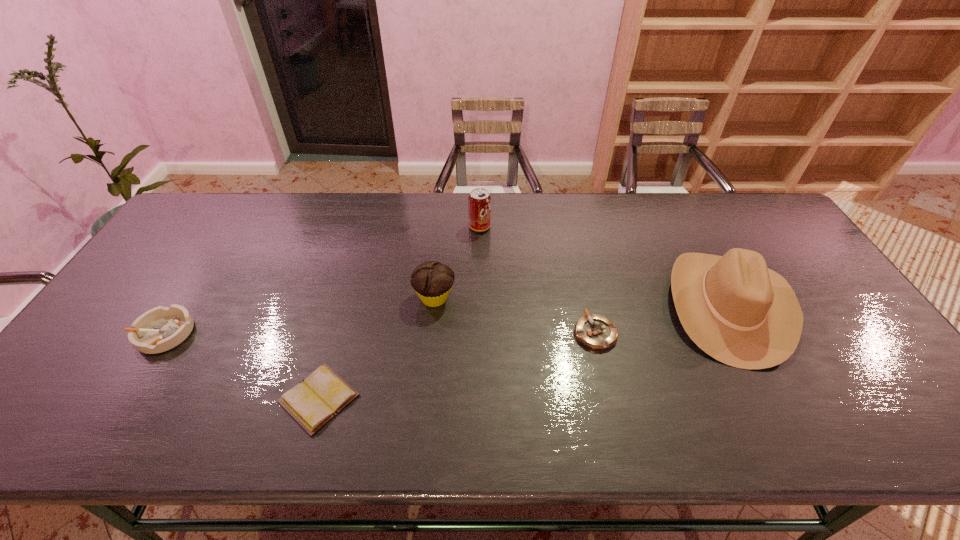
In order to click on object that is at the left edge in this screenshot , I will do 160,329.

Locate an element on the screen. The image size is (960, 540). object located at the right edge is located at coordinates [743, 314].

The image size is (960, 540). I want to click on vacant area at the far edge, so click(x=300, y=228).

Where is `free space at the near edge`? The height and width of the screenshot is (540, 960). free space at the near edge is located at coordinates (247, 436).

In the image, there is a desktop. At what (x,y) coordinates should I click in order to perform the action: click on free space at the left edge. Please return your answer as a coordinate pair (x, y). The width and height of the screenshot is (960, 540). Looking at the image, I should click on (106, 335).

Identify the location of vacant space at the far left corner of the desktop. click(x=232, y=193).

The width and height of the screenshot is (960, 540). Find the location of `vacant region between the diary and the muffin`. vacant region between the diary and the muffin is located at coordinates click(376, 348).

This screenshot has width=960, height=540. I want to click on vacant space that is in between the leftmost object and the second tallest object, so click(322, 280).

This screenshot has width=960, height=540. Identify the location of free space between the shortest object and the farthest object. click(399, 313).

Find the location of a particular element. The image size is (960, 540). free area in between the cowboy hat and the muffin is located at coordinates (582, 302).